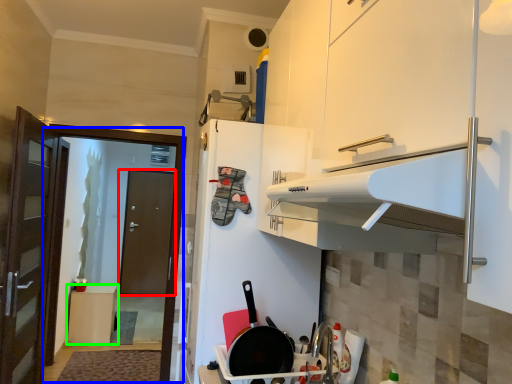
Question: Which object is positioned closest to door (highlighted by a red box)? Select from screen door (highlighted by a blue box) and furniture (highlighted by a green box).

Choices:
 (A) screen door
 (B) furniture

Answer: (B)